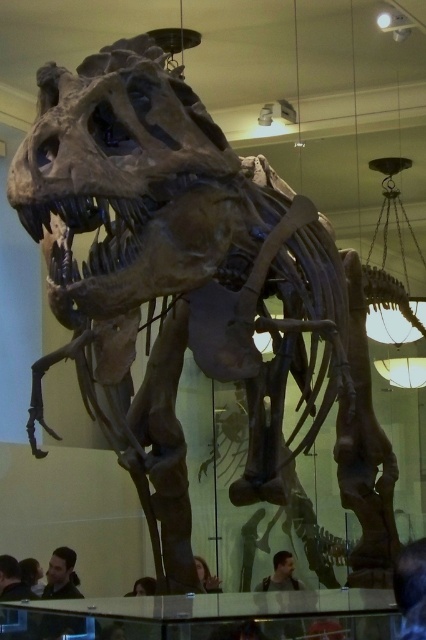
Question: Is dark brown hair at lower left to the left of smooth brown hair at lower center from the viewer's perspective?

Choices:
 (A) no
 (B) yes

Answer: (B)

Question: Which point is closer to the camera?

Choices:
 (A) brown leather jacket at center
 (B) smooth brown hair at lower center

Answer: (B)

Question: Which object appears farthest from the camera in this image?

Choices:
 (A) smooth brown hair at lower center
 (B) brown leather jacket at center

Answer: (B)

Question: Does dark brown hair at lower left have a smaller size compared to dark brown leather jacket at lower center?

Choices:
 (A) yes
 (B) no

Answer: (B)

Question: Is dark brown hair at lower left positioned before dark brown leather jacket at lower center?

Choices:
 (A) no
 (B) yes

Answer: (A)

Question: Considering the real-world distances, which object is farthest from the dark brown leather jacket at lower center?

Choices:
 (A) brown leather jacket at center
 (B) smooth brown hair at lower center
 (C) dark brown hair at lower left
 (D) dark hair at lower right

Answer: (C)